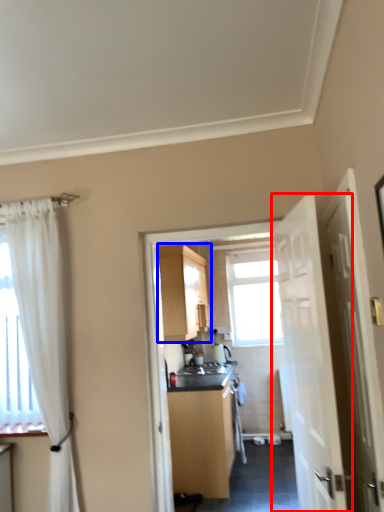
Question: Which object is closer to the camera taking this photo, door (highlighted by a red box) or cabinetry (highlighted by a blue box)?

Choices:
 (A) door
 (B) cabinetry

Answer: (A)